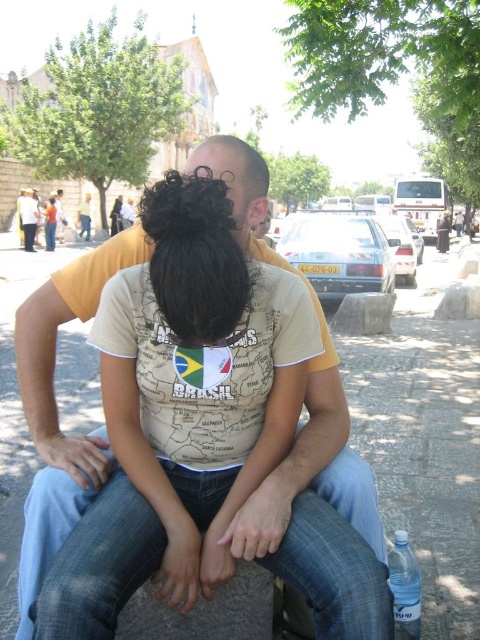
You are a photographer taking a picture of the yellow cotton shirt at center and the transparent plastic bottle at lower right. Which object should you focus on first if you want to capture both clearly in your shot?

The yellow cotton shirt at center is larger in size than the transparent plastic bottle at lower right, so you should focus on the yellow cotton shirt at center first to ensure it is in sharp focus before adjusting for the smaller bottle.

You are a photographer trying to capture a candid shot of the two people on the stone bench. You notice a transparent plastic bottle at lower right and a white cotton shirt at center. Which object is smaller in size?

The transparent plastic bottle at lower right is smaller in size compared to the white cotton shirt at center.